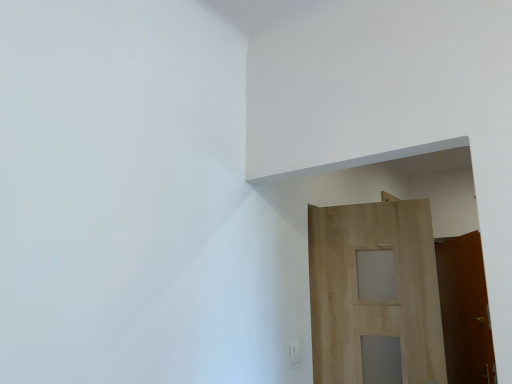
This screenshot has height=384, width=512. What do you see at coordinates (374, 300) in the screenshot?
I see `light brown wood door at right` at bounding box center [374, 300].

Locate an element on the screen. The height and width of the screenshot is (384, 512). light brown wood door at right is located at coordinates (374, 300).

Where is `light brown wood door at right`? The width and height of the screenshot is (512, 384). light brown wood door at right is located at coordinates 374,300.